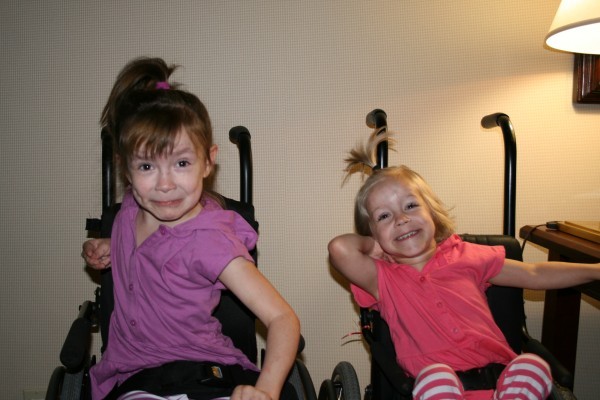
This screenshot has width=600, height=400. In order to click on table edge in this screenshot , I will do `click(536, 226)`.